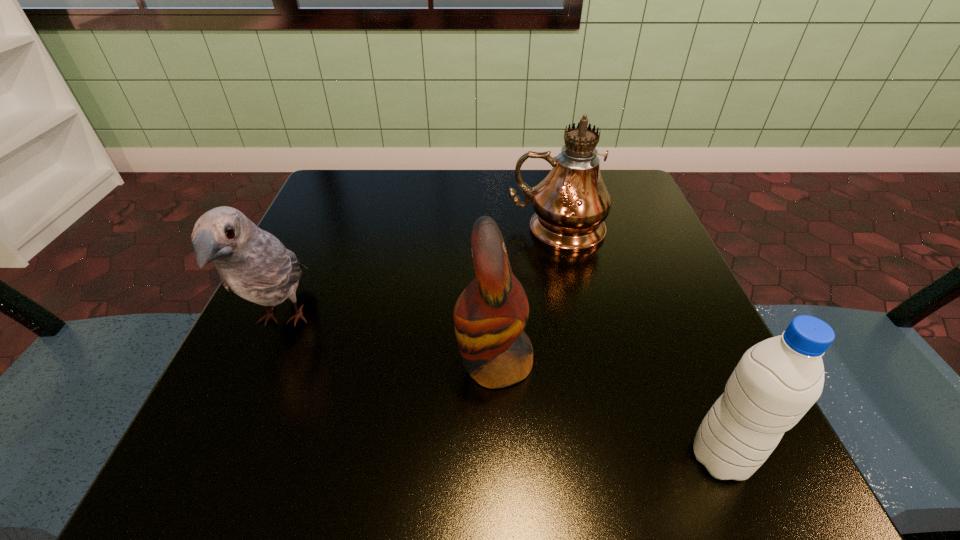
At what (x,y) coordinates should I click in order to perform the action: click on vacant point located between the tallest object and the water bottle. Please return your answer as a coordinate pair (x, y). Looking at the image, I should click on (638, 343).

Locate an element on the screen. This screenshot has width=960, height=540. empty space between the tallest object and the water bottle is located at coordinates point(638,343).

Where is `free space between the right parrot and the left parrot`? Image resolution: width=960 pixels, height=540 pixels. free space between the right parrot and the left parrot is located at coordinates (389, 342).

Identify which object is located as the nearest to the leftmost object. Please provide its 2D coordinates. Your answer should be formatted as a tuple, i.e. [(x, y)], where the tuple contains the x and y coordinates of a point satisfying the conditions above.

[(489, 316)]

Find the location of a particular element. Image resolution: width=960 pixels, height=540 pixels. object that is the second closest one to the right parrot is located at coordinates (571, 203).

Find the location of a particular element. free spot that satisfies the following two spatial constraints: 1. on the face of the right parrot; 2. on the left side of the water bottle is located at coordinates (497, 457).

The height and width of the screenshot is (540, 960). I want to click on vacant point that satisfies the following two spatial constraints: 1. on the front-facing side of the water bottle; 2. on the right side of the left parrot, so click(222, 457).

You are a GUI agent. You are given a task and a screenshot of the screen. Output one action in this format:
    pyautogui.click(x=<x>, y=<y>)
    Task: Click on the free space that satisfies the following two spatial constraints: 1. on the front side of the water bottle; 2. on the right side of the farthest object
    The width and height of the screenshot is (960, 540).
    Given the screenshot: What is the action you would take?
    pyautogui.click(x=607, y=457)

This screenshot has height=540, width=960. In order to click on free point that satisfies the following two spatial constraints: 1. on the face of the nearest object; 2. on the right side of the right parrot in this screenshot , I will do `click(497, 457)`.